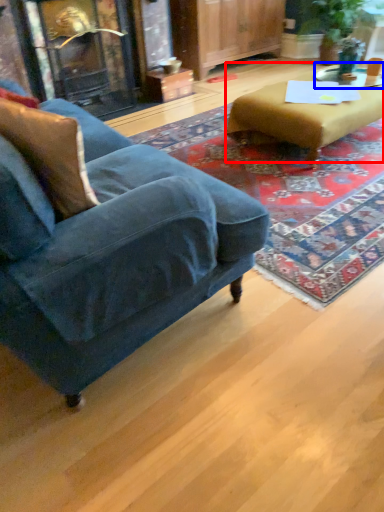
Question: Which of the following is the farthest to the observer, table (highlighted by a red box) or side table (highlighted by a blue box)?

Choices:
 (A) table
 (B) side table

Answer: (B)